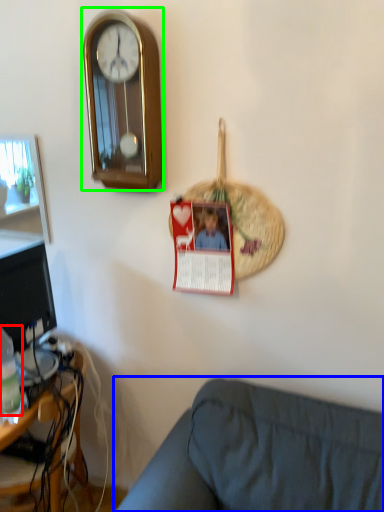
Question: Which object is positioned farthest from bottle (highlighted by a red box)? Select from studio couch (highlighted by a blue box) and wall clock (highlighted by a green box).

Choices:
 (A) studio couch
 (B) wall clock

Answer: (B)